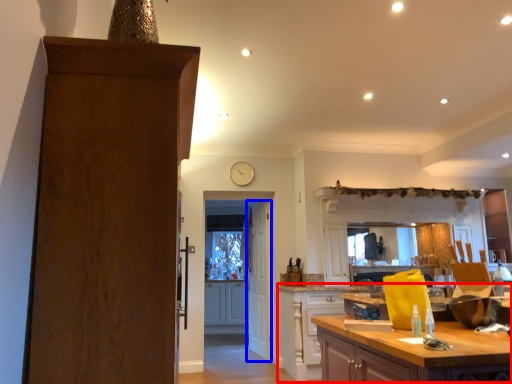
Question: Which object is further to the camera taking this photo, cabinetry (highlighted by a red box) or door (highlighted by a blue box)?

Choices:
 (A) cabinetry
 (B) door

Answer: (B)